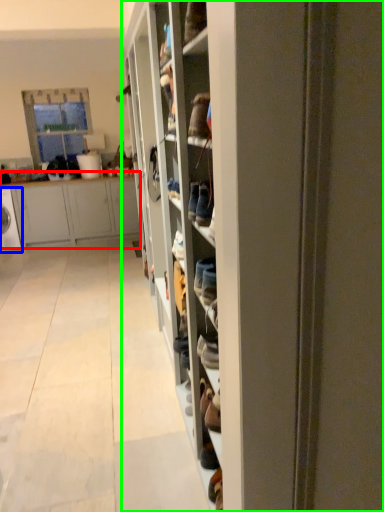
Question: Considering the real-world distances, which object is farthest from cabinetry (highlighted by a red box)? washing machine (highlighted by a blue box) or shelf (highlighted by a green box)?

Choices:
 (A) washing machine
 (B) shelf

Answer: (B)